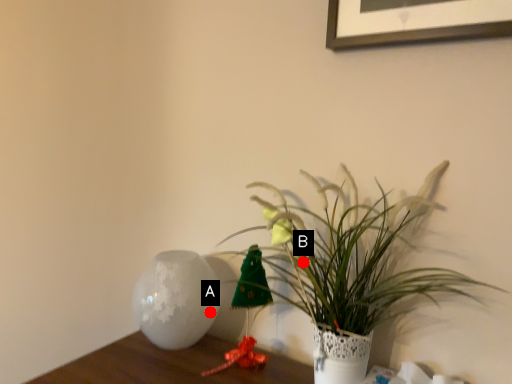
Question: Two points are circled on the image, labeled by A and B beside each circle. Which point is farther to the camera?

Choices:
 (A) A is further
 (B) B is further

Answer: (A)